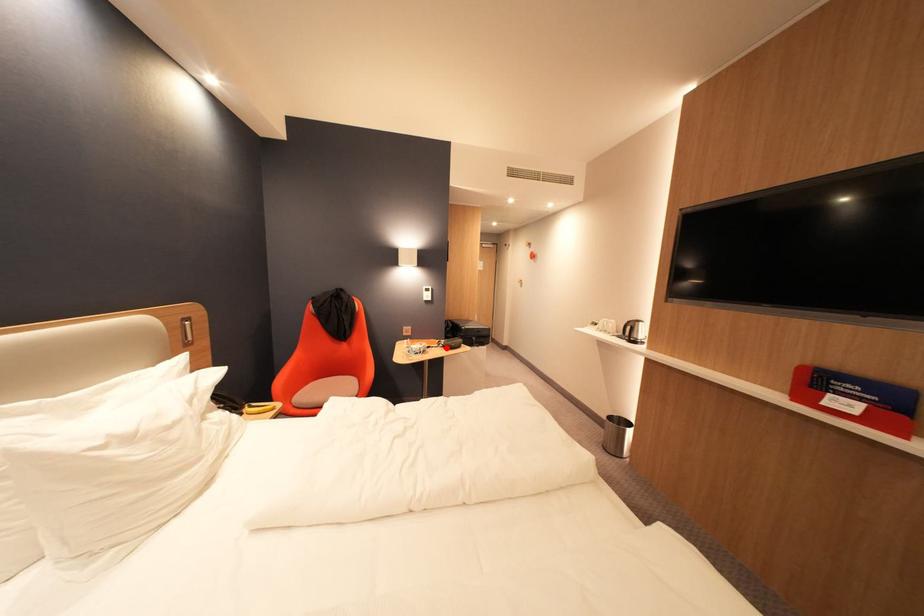
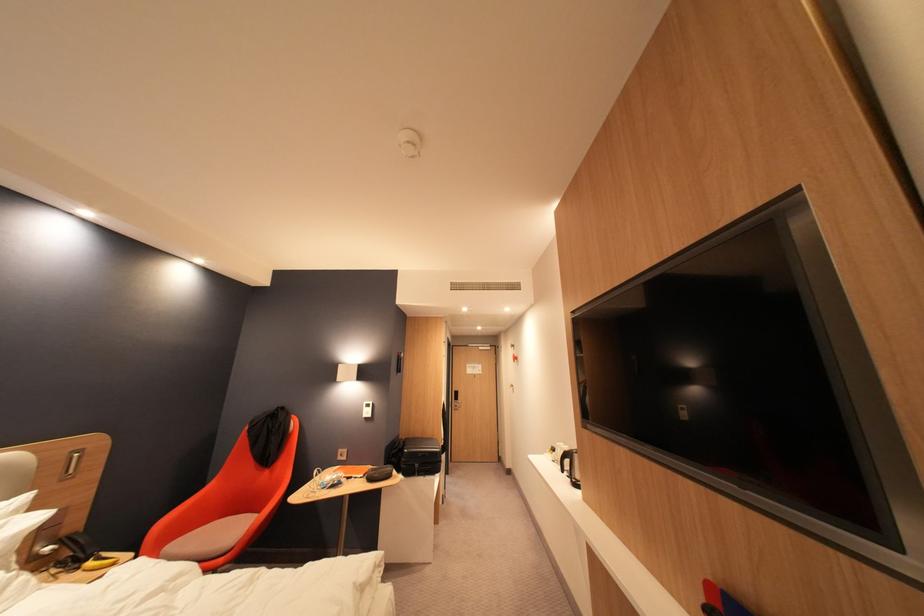
Question: I am providing you with two images of the same scene from different viewpoints. A red point is shown in image1. For the corresponding object point in image2, is it positioned nearer or farther from the camera?

Choices:
 (A) Nearer
 (B) Farther

Answer: (B)